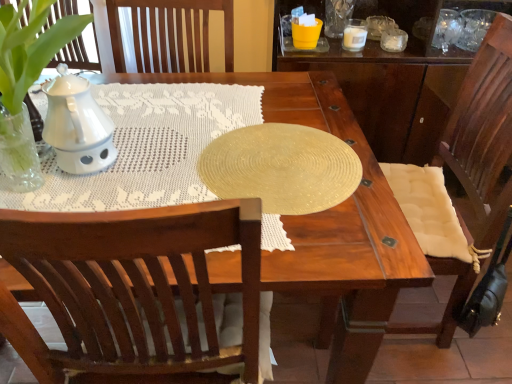
Question: Could you tell me if white textured cushion at right is turned towards white ceramic candle at upper right?

Choices:
 (A) yes
 (B) no

Answer: (B)

Question: Is white textured cushion at right positioned beyond the bounds of white ceramic candle at upper right?

Choices:
 (A) no
 (B) yes

Answer: (B)

Question: Can you confirm if white textured cushion at right is shorter than white ceramic candle at upper right?

Choices:
 (A) no
 (B) yes

Answer: (A)

Question: Is white textured cushion at right to the left of white ceramic candle at upper right from the viewer's perspective?

Choices:
 (A) yes
 (B) no

Answer: (B)

Question: Is white textured cushion at right surrounding white ceramic candle at upper right?

Choices:
 (A) no
 (B) yes

Answer: (A)

Question: Considering the relative positions of white ceramic candle at upper right and shiny gold placemat at center in the image provided, is white ceramic candle at upper right to the left or to the right of shiny gold placemat at center?

Choices:
 (A) left
 (B) right

Answer: (B)

Question: Considering the positions of white ceramic candle at upper right and shiny gold placemat at center in the image, is white ceramic candle at upper right bigger or smaller than shiny gold placemat at center?

Choices:
 (A) big
 (B) small

Answer: (B)

Question: From a real-world perspective, relative to shiny gold placemat at center, is white ceramic candle at upper right vertically above or below?

Choices:
 (A) below
 (B) above

Answer: (A)

Question: Is white ceramic candle at upper right wider or thinner than shiny gold placemat at center?

Choices:
 (A) wide
 (B) thin

Answer: (B)

Question: Is shiny gold placemat at center in front of or behind white ceramic candle at upper right in the image?

Choices:
 (A) behind
 (B) front

Answer: (B)

Question: Is shiny gold placemat at center taller or shorter than white ceramic candle at upper right?

Choices:
 (A) tall
 (B) short

Answer: (B)

Question: Considering the positions of shiny gold placemat at center and white ceramic candle at upper right in the image, is shiny gold placemat at center bigger or smaller than white ceramic candle at upper right?

Choices:
 (A) big
 (B) small

Answer: (A)

Question: Is shiny gold placemat at center to the left or to the right of white ceramic candle at upper right in the image?

Choices:
 (A) right
 (B) left

Answer: (B)

Question: Visually, is shiny gold placemat at center positioned to the left or to the right of white textured cushion at right?

Choices:
 (A) right
 (B) left

Answer: (B)

Question: Would you say shiny gold placemat at center is inside or outside white textured cushion at right?

Choices:
 (A) inside
 (B) outside

Answer: (B)